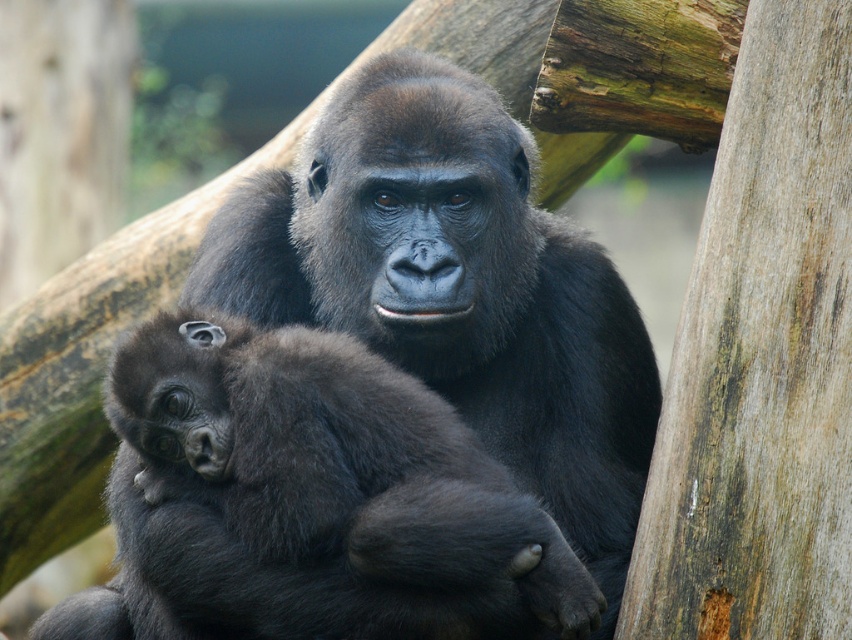
Can you confirm if soft fur baby gorilla at center is positioned below smooth brown wood at right?

Correct, soft fur baby gorilla at center is located below smooth brown wood at right.

How far apart are soft fur baby gorilla at center and smooth brown wood at right?

soft fur baby gorilla at center and smooth brown wood at right are 14.69 inches apart from each other.

Measure the distance between soft fur baby gorilla at center and camera.

2.08 meters

At what (x,y) coordinates should I click in order to perform the action: click on soft fur baby gorilla at center. Please return your answer as a coordinate pair (x, y). Looking at the image, I should click on (309, 500).